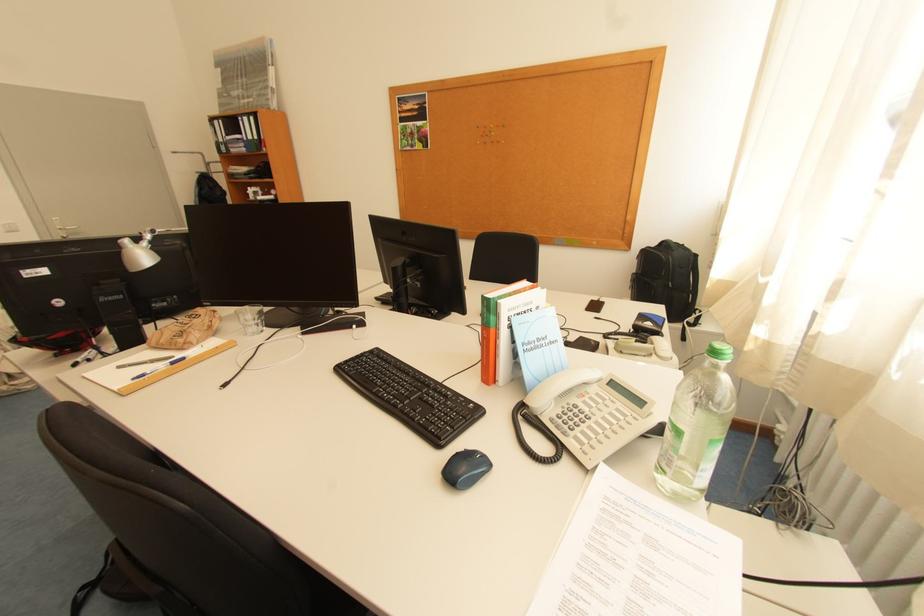
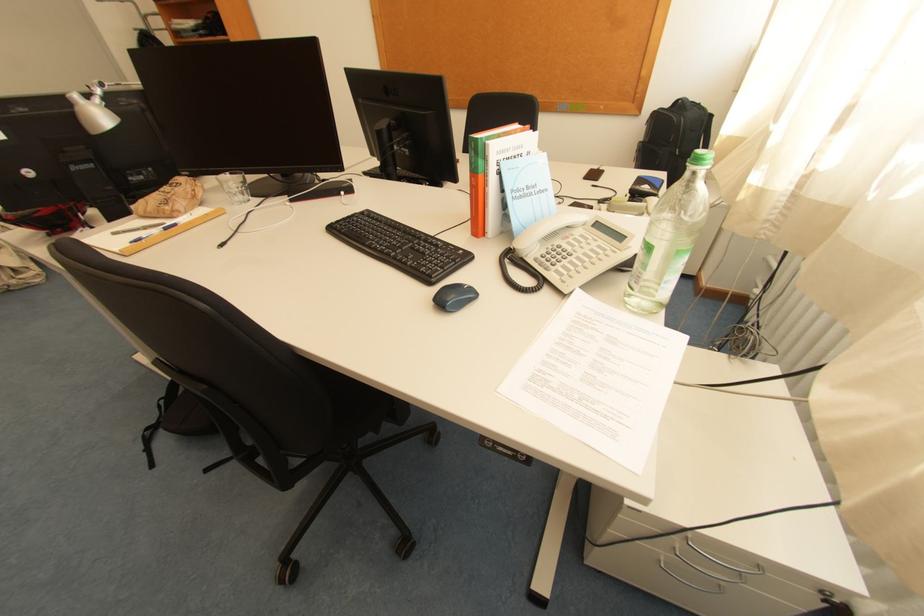
Locate, in the second image, the point that corresponds to point 536,408 in the first image.

(523, 251)